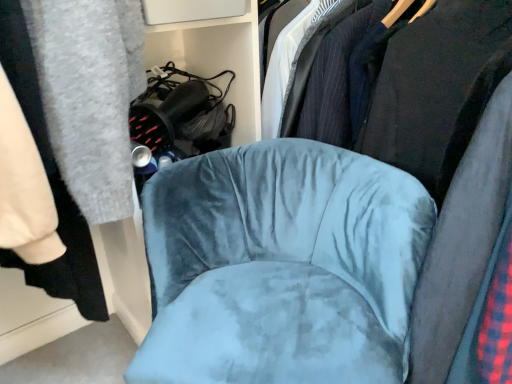
Question: Is velvet blue chair at center bigger than velvet black bookshelf at upper center?

Choices:
 (A) no
 (B) yes

Answer: (B)

Question: Does velvet blue chair at center appear on the right side of velvet black bookshelf at upper center?

Choices:
 (A) yes
 (B) no

Answer: (A)

Question: Considering the relative sizes of velvet blue chair at center and velvet black bookshelf at upper center in the image provided, is velvet blue chair at center smaller than velvet black bookshelf at upper center?

Choices:
 (A) yes
 (B) no

Answer: (B)

Question: Does velvet blue chair at center come behind velvet black bookshelf at upper center?

Choices:
 (A) yes
 (B) no

Answer: (B)

Question: Is velvet blue chair at center positioned far away from velvet black bookshelf at upper center?

Choices:
 (A) yes
 (B) no

Answer: (B)

Question: Considering their positions, is velvet blue chair at center located in front of or behind velvet black bookshelf at upper center?

Choices:
 (A) front
 (B) behind

Answer: (A)

Question: In terms of width, does velvet blue chair at center look wider or thinner when compared to velvet black bookshelf at upper center?

Choices:
 (A) wide
 (B) thin

Answer: (A)

Question: From a real-world perspective, relative to velvet black bookshelf at upper center, is velvet blue chair at center vertically above or below?

Choices:
 (A) below
 (B) above

Answer: (B)

Question: Is point (461, 84) positioned closer to the camera than point (258, 57)?

Choices:
 (A) closer
 (B) farther

Answer: (A)

Question: In the image, is velvet black bookshelf at upper center positioned in front of or behind velvet blue chair at center?

Choices:
 (A) behind
 (B) front

Answer: (A)

Question: In terms of height, does velvet black bookshelf at upper center look taller or shorter compared to velvet blue chair at center?

Choices:
 (A) short
 (B) tall

Answer: (A)

Question: Is velvet black bookshelf at upper center bigger or smaller than velvet blue chair at center?

Choices:
 (A) big
 (B) small

Answer: (B)

Question: Would you say velvet black bookshelf at upper center is inside or outside velvet blue chair at center?

Choices:
 (A) outside
 (B) inside

Answer: (A)

Question: From the image's perspective, relative to velvet black bookshelf at upper center, is velvet blue chair at center above or below?

Choices:
 (A) below
 (B) above

Answer: (A)

Question: Which is correct: velvet blue chair at center is inside velvet black bookshelf at upper center, or outside of it?

Choices:
 (A) inside
 (B) outside

Answer: (B)